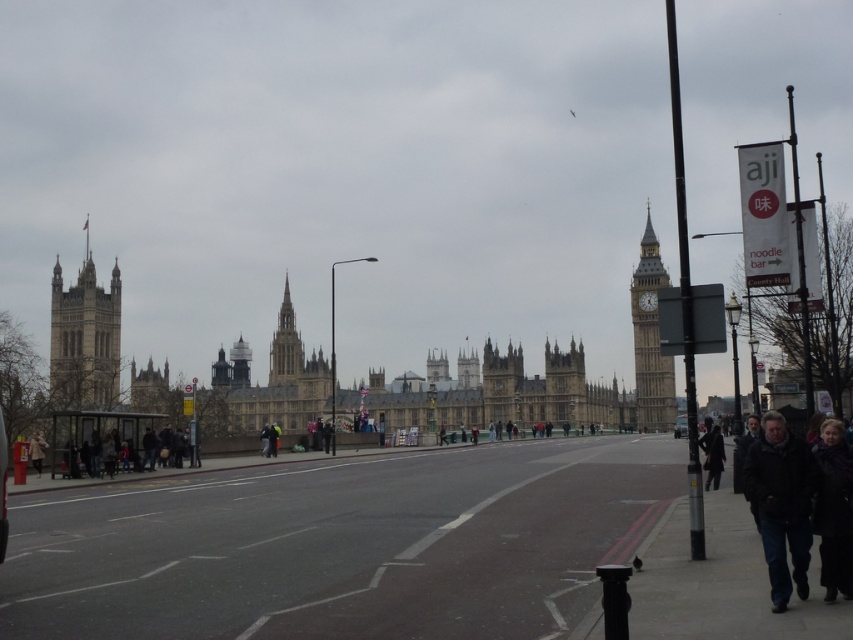
Question: Which point appears farthest from the camera in this image?

Choices:
 (A) (277, 358)
 (B) (781, 552)

Answer: (A)

Question: Among these points, which one is farthest from the camera?

Choices:
 (A) (38, 449)
 (B) (656, 412)

Answer: (B)

Question: Estimate the real-world distances between objects in this image. Which object is farther from the dark brown coat at lower right?

Choices:
 (A) dark fur coat at lower right
 (B) smooth stone spire at center

Answer: (B)

Question: Is the position of black matte jacket at lower right more distant than that of golden stone clock tower at right?

Choices:
 (A) yes
 (B) no

Answer: (B)

Question: Can you confirm if dark gray asphalt at center is thinner than dark brown coat at lower right?

Choices:
 (A) yes
 (B) no

Answer: (B)

Question: Does dark gray asphalt at center have a greater width compared to golden stone clock tower at right?

Choices:
 (A) yes
 (B) no

Answer: (A)